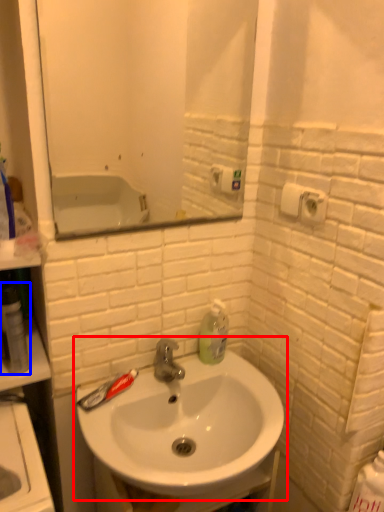
Question: Which of the following is the farthest to the observer, sink (highlighted by a red box) or mouthwash (highlighted by a blue box)?

Choices:
 (A) sink
 (B) mouthwash

Answer: (B)